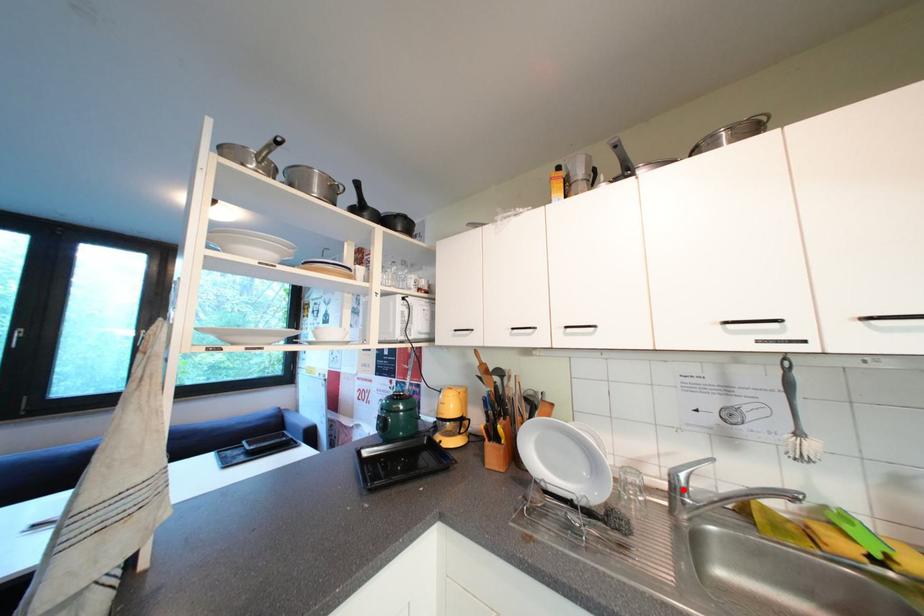
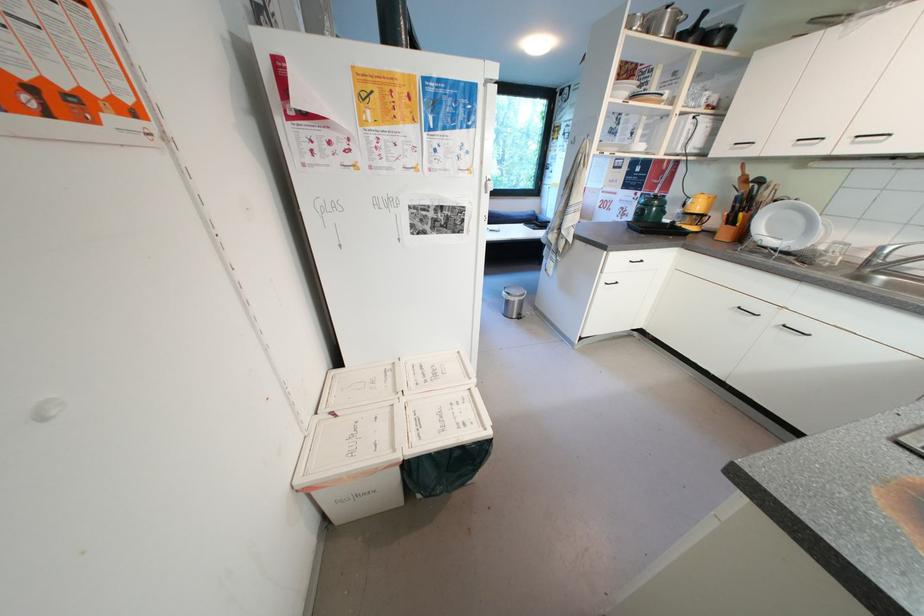
In the second image, find the point that corresponds to the highlighted location in the first image.

(883, 257)